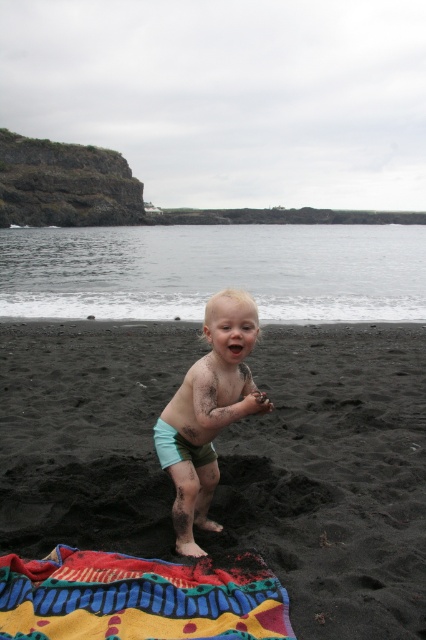
You are a photographer trying to capture the child in the center. The multicolored woven towel at lower left is blocking part of the view. Can you move the towel to the side without moving the dirty teal shorts at center? Explain why or why not based on their sizes.

The multicolored woven towel at lower left is wider than the dirty teal shorts at center. Since the towel is wider, moving it might require more space, but since the shorts are narrower, you can adjust the towel around them without moving the shorts.

In the scene shown: You are a parent at the beach and your child is standing on the black sand at center. You notice the light blue fabric diaper at center. Where is the diaper in relation to the sand?

The light blue fabric diaper at center is above the black sand at center because the black sand at center is below it.

You are a parent at the beach and want to cover your child with either the multicolored woven towel at lower left or the light blue fabric diaper at center. Which item would provide more coverage for your child?

The multicolored woven towel at lower left is bigger than the light blue fabric diaper at center, so it would provide more coverage for your child.